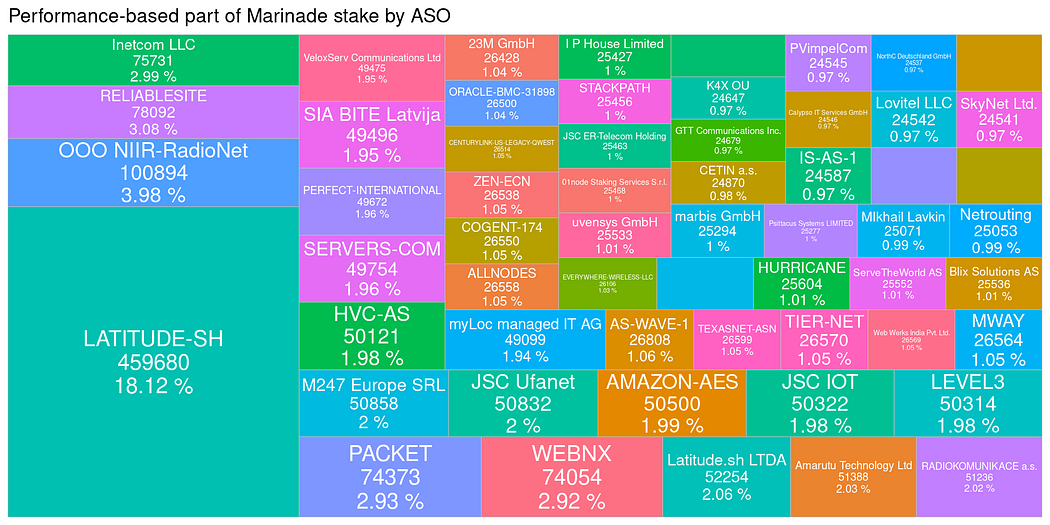
Locate an element on the screen. The image size is (1050, 525). small brown box upper right without text is located at coordinates (1009, 75).